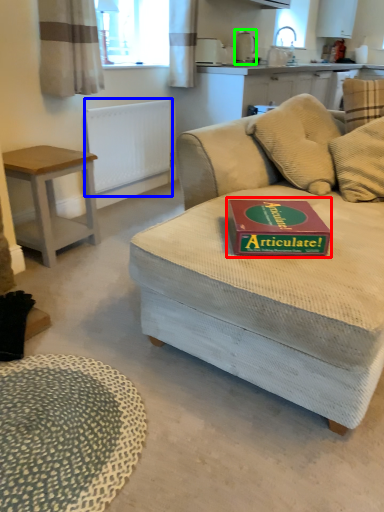
Question: Considering the real-world distances, which object is closest to paperback book (highlighted by a red box)? radiator (highlighted by a blue box) or appliance (highlighted by a green box).

Choices:
 (A) radiator
 (B) appliance

Answer: (A)